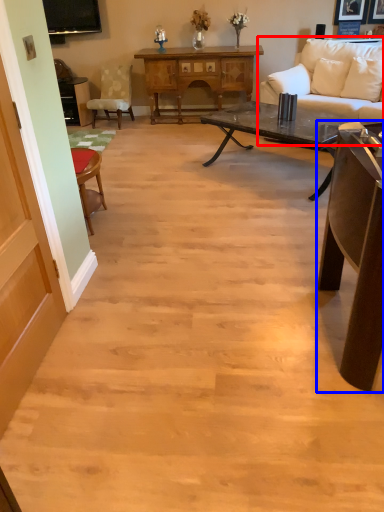
Question: Which of the following is the closest to the observer, studio couch (highlighted by a red box) or table (highlighted by a blue box)?

Choices:
 (A) studio couch
 (B) table

Answer: (B)